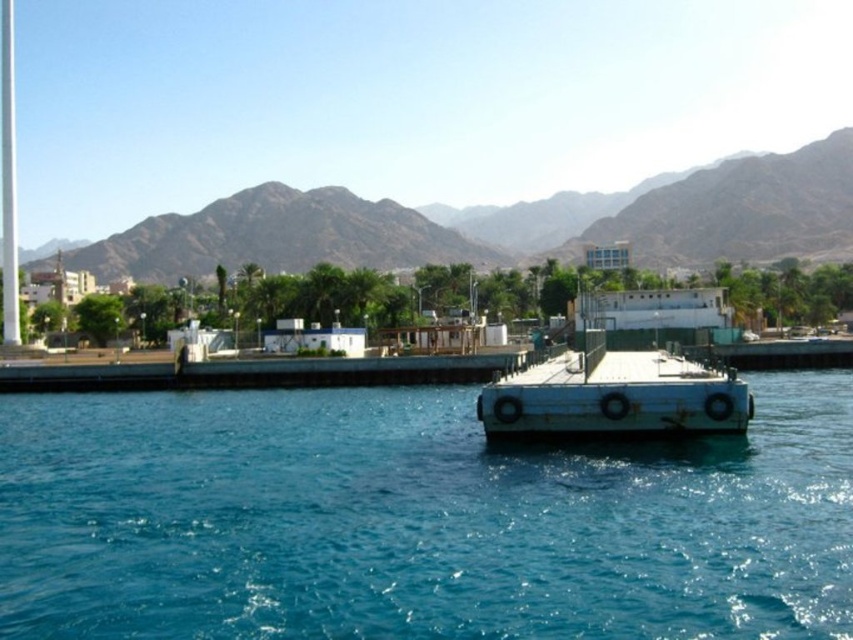
Question: Which point is farther to the camera?

Choices:
 (A) (548, 401)
 (B) (202, 621)

Answer: (A)

Question: Which of the following is the closest to the observer?

Choices:
 (A) (24, 509)
 (B) (279, 198)
 (C) (699, 420)

Answer: (A)

Question: Considering the real-world distances, which object is closest to the brown rocky mountain at upper center?

Choices:
 (A) white matte dock at center
 (B) blue glossy water at center

Answer: (A)

Question: Considering the relative positions of blue glossy water at center and brown rocky mountain at upper center in the image provided, where is blue glossy water at center located with respect to brown rocky mountain at upper center?

Choices:
 (A) above
 (B) below

Answer: (B)

Question: In this image, where is blue glossy water at center located relative to brown rocky mountain at upper center?

Choices:
 (A) below
 (B) above

Answer: (A)

Question: In this image, where is blue glossy water at center located relative to white matte dock at center?

Choices:
 (A) above
 (B) below

Answer: (B)